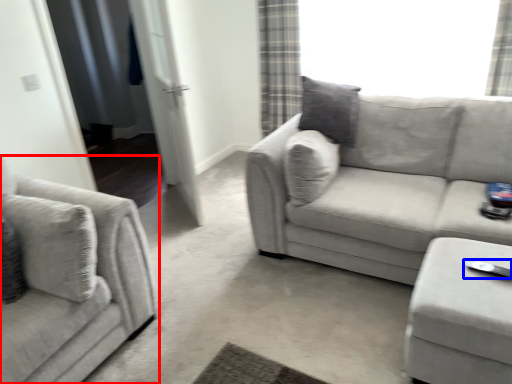
Question: Which point is closer to the camera, studio couch (highlighted by a red box) or Wii controller (highlighted by a blue box)?

Choices:
 (A) studio couch
 (B) Wii controller

Answer: (A)